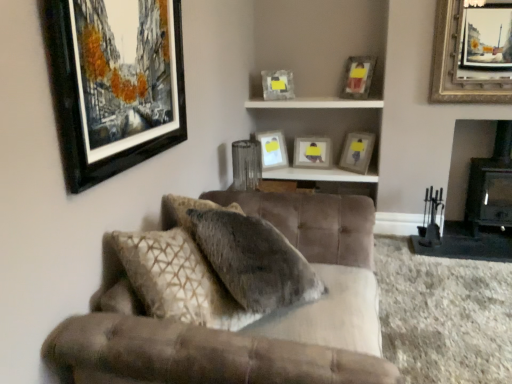
The width and height of the screenshot is (512, 384). I want to click on vacant area situated below gold-framed painting at upper right, which appears as the 7th picture frame when viewed from the left (from a real-world perspective), so coord(455,239).